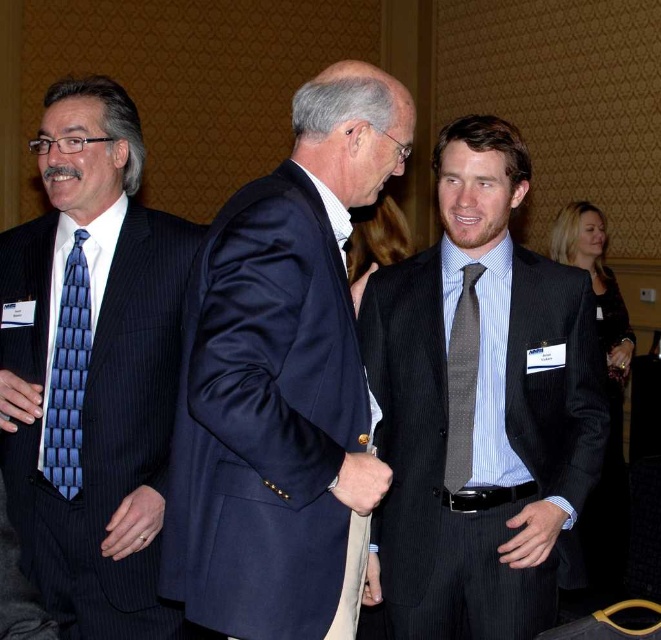
You are a photographer at the event and want to ensure that both the navy blue suit at center and the blue woven tie at left are clearly visible in your photo. Considering their sizes, which one might you need to focus on more carefully to avoid blurring due to its size?

The navy blue suit at center is taller than the blue woven tie at left, so you should focus more on the navy blue suit at center to avoid blurring because larger objects require more precise focusing.

From the picture: You are a photographer at the event and want to take a portrait of both the gray striped suit at right and the gray textured tie at center. Which object should you focus on first to ensure both are in sharp focus?

You should focus on the gray textured tie at center first because it is farther from the viewer than the gray striped suit at right, ensuring both will be in focus when using a shallow depth of field.